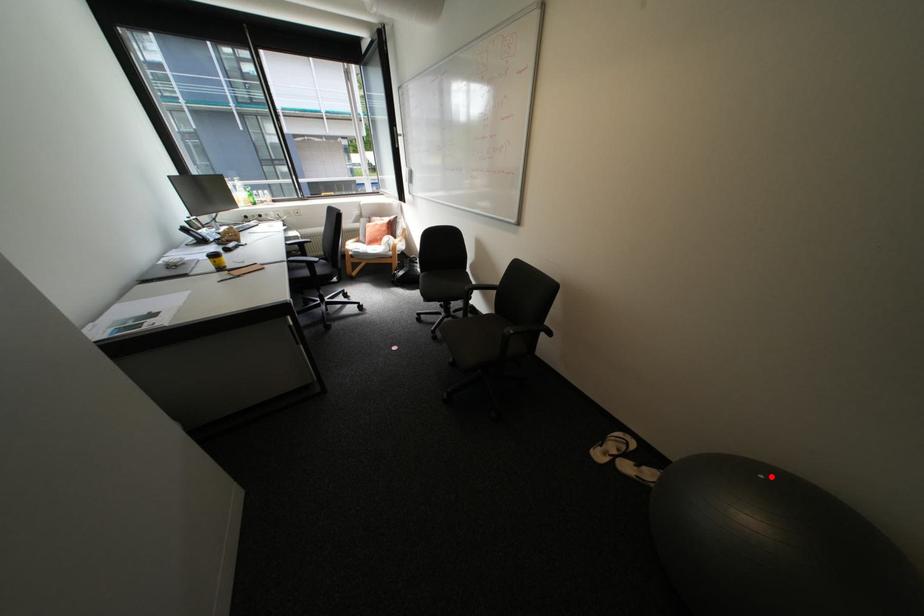
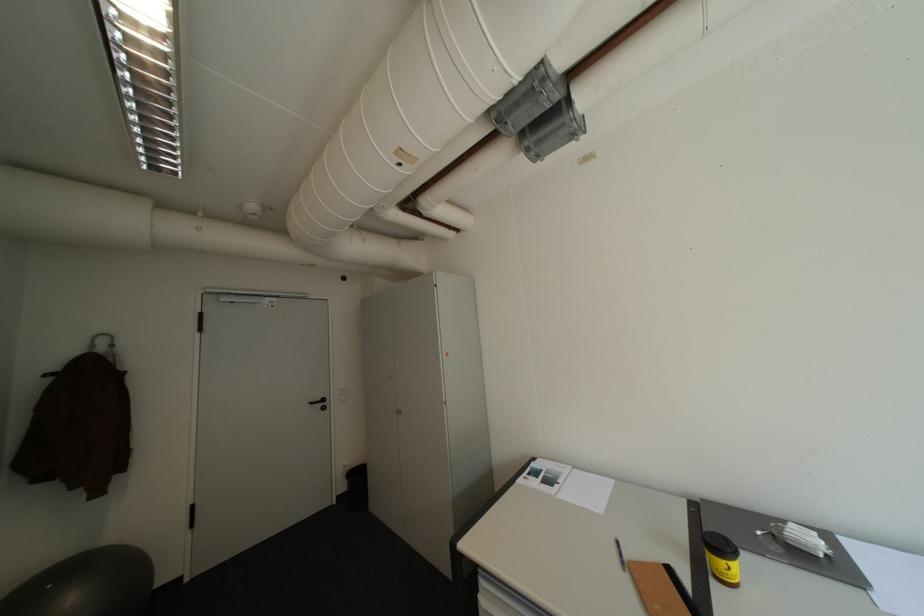
Where in the second image is the point corresponding to the highlighted location from the first image?

(59, 586)